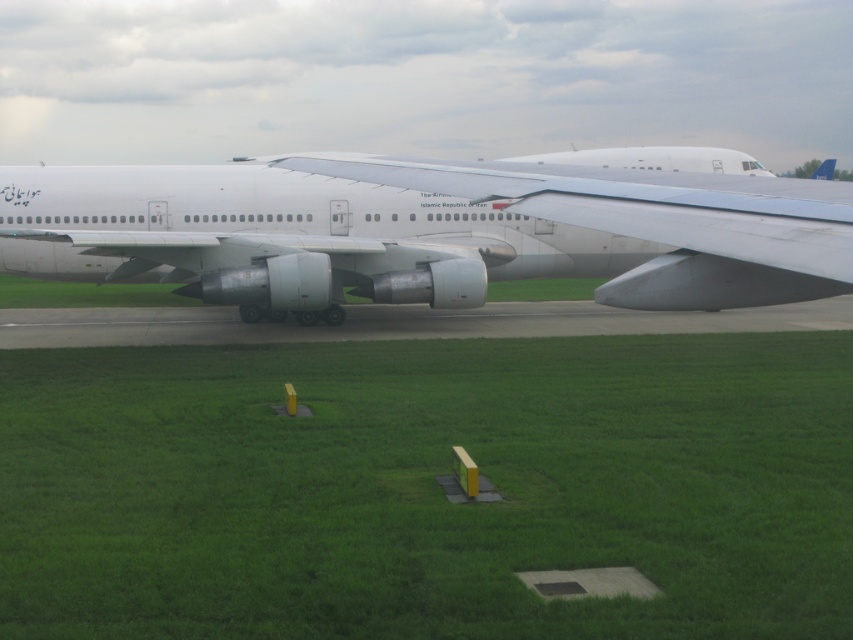
Question: Can you confirm if white metallic airplane at center is positioned below white matte tail at upper center?

Choices:
 (A) no
 (B) yes

Answer: (B)

Question: Can you confirm if white metallic airplane at center is positioned above white matte tail at upper center?

Choices:
 (A) no
 (B) yes

Answer: (A)

Question: Which object is the farthest from the white metallic airplane at center?

Choices:
 (A) green grass at center
 (B) white matte tail at upper center

Answer: (B)

Question: Is green grass at center above white matte tail at upper center?

Choices:
 (A) no
 (B) yes

Answer: (A)

Question: Among these points, which one is farthest from the camera?

Choices:
 (A) (656, 385)
 (B) (817, 168)
 (C) (136, 196)

Answer: (B)

Question: Which of the following is the farthest from the observer?

Choices:
 (A) green grass at center
 (B) white metallic airplane at center
 (C) white matte tail at upper center

Answer: (C)